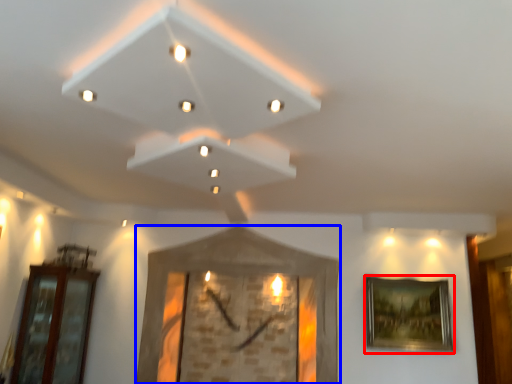
Question: Which object appears farthest to the camera in this image, picture frame (highlighted by a red box) or picture frame (highlighted by a blue box)?

Choices:
 (A) picture frame
 (B) picture frame

Answer: (A)